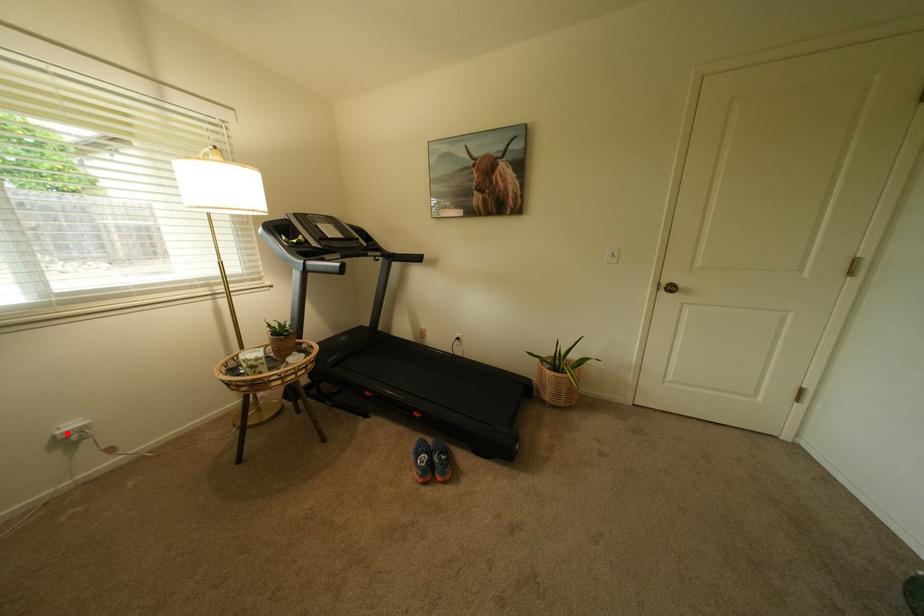
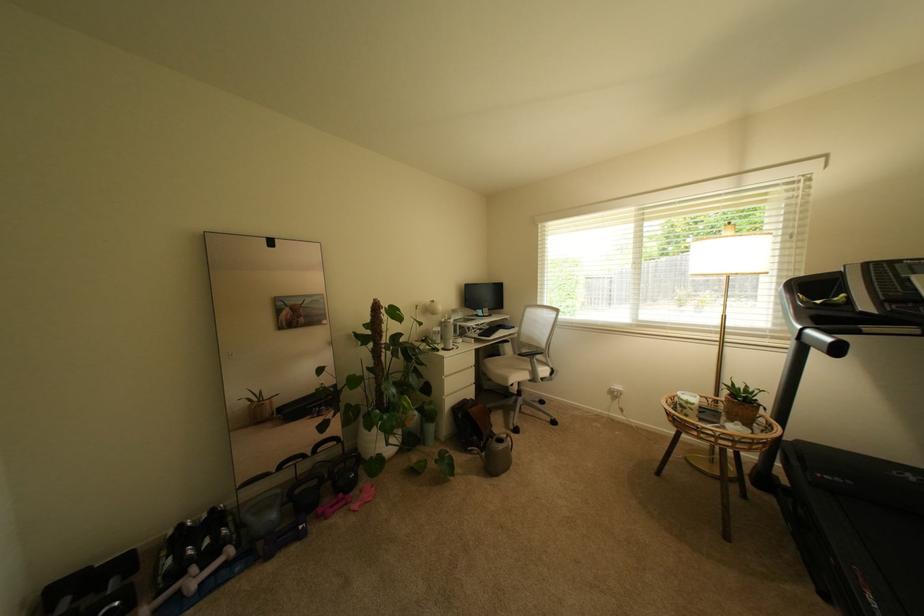
Question: I am providing you with two images of the same scene from different viewpoints. Given a red point in image1, look at the same physical point in image2. Is it:

Choices:
 (A) Closer to the viewpoint
 (B) Farther from the viewpoint

Answer: (A)